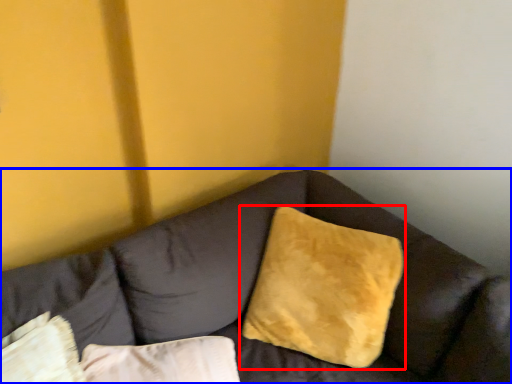
Question: Which object appears closest to the camera in this image, pillow (highlighted by a red box) or studio couch (highlighted by a blue box)?

Choices:
 (A) pillow
 (B) studio couch

Answer: (B)